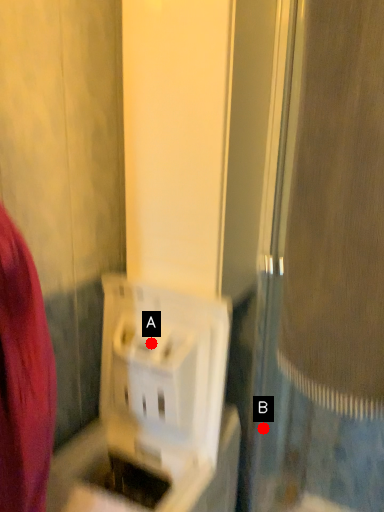
Question: Two points are circled on the image, labeled by A and B beside each circle. Which point appears farthest from the camera in this image?

Choices:
 (A) A is further
 (B) B is further

Answer: (B)